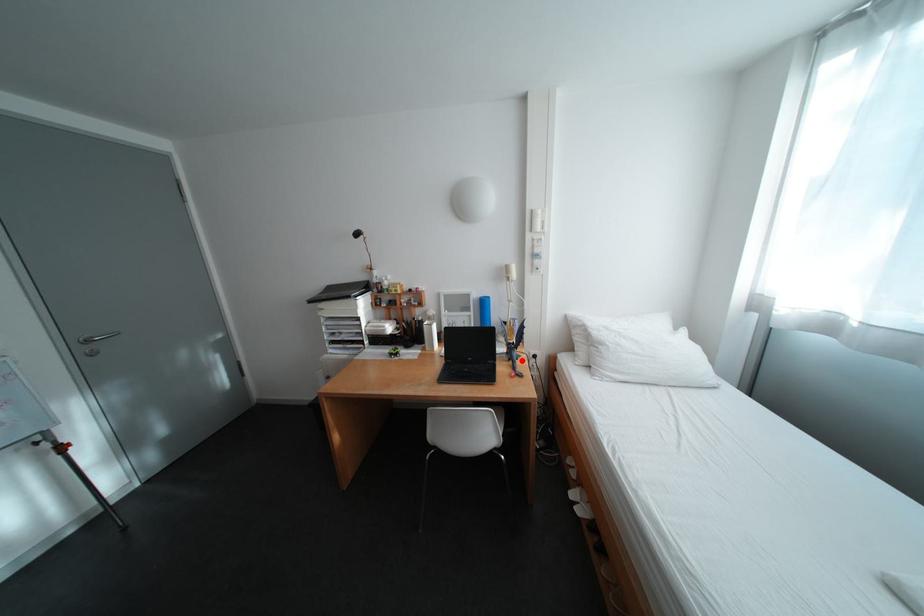
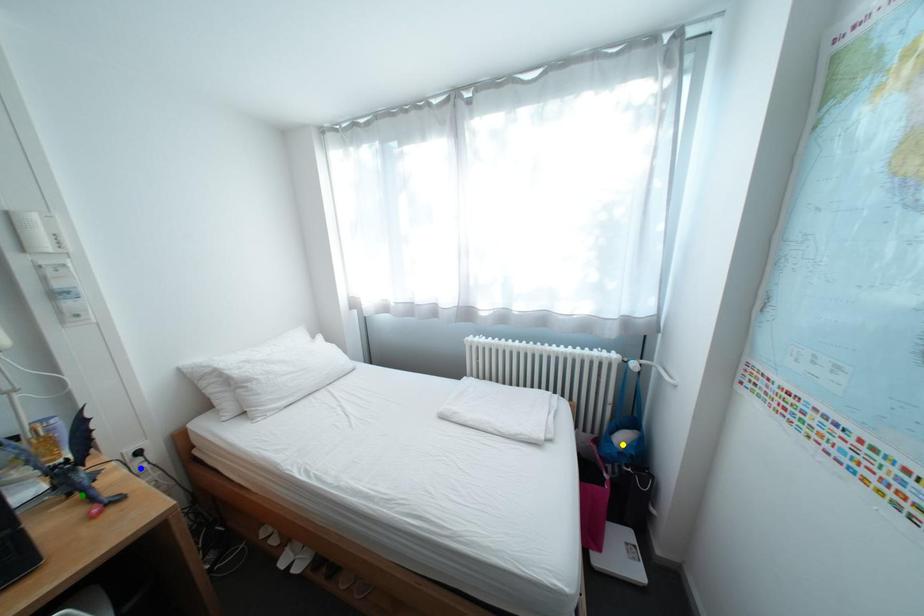
Question: I am providing you with two images of the same scene from different viewpoints. A red point is marked on the first image. You are given multiple points on the second image. Can you choose the point in image 2 that corresponds to the point in image 1?

Choices:
 (A) yellow point
 (B) blue point
 (C) green point

Answer: (C)